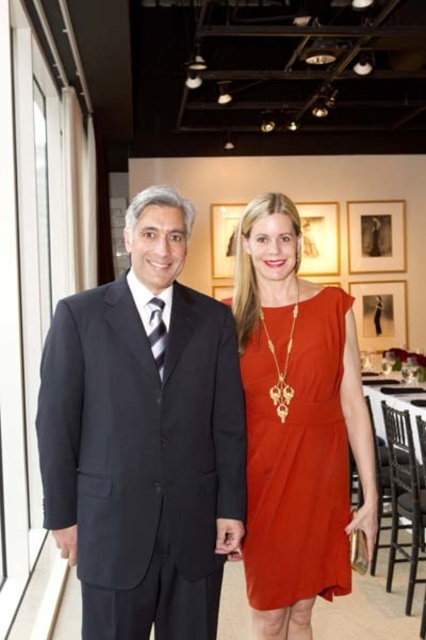
Is black suit at left below matte orange dress at center?

Actually, black suit at left is above matte orange dress at center.

Is black suit at left further to camera compared to matte orange dress at center?

No, it is not.

Locate an element on the screen. This screenshot has height=640, width=426. black suit at left is located at coordinates (143, 436).

The height and width of the screenshot is (640, 426). What are the coordinates of `black suit at left` in the screenshot? It's located at (143, 436).